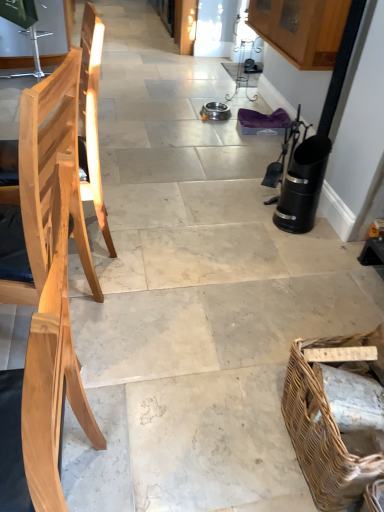
You are a GUI agent. You are given a task and a screenshot of the screen. Output one action in this format:
    pyautogui.click(x=<x>, y=<y>)
    Task: Click on the free point behind natural wood chair at left, the 1th chair when ordered from front to back
    
    Given the screenshot: What is the action you would take?
    pyautogui.click(x=118, y=410)